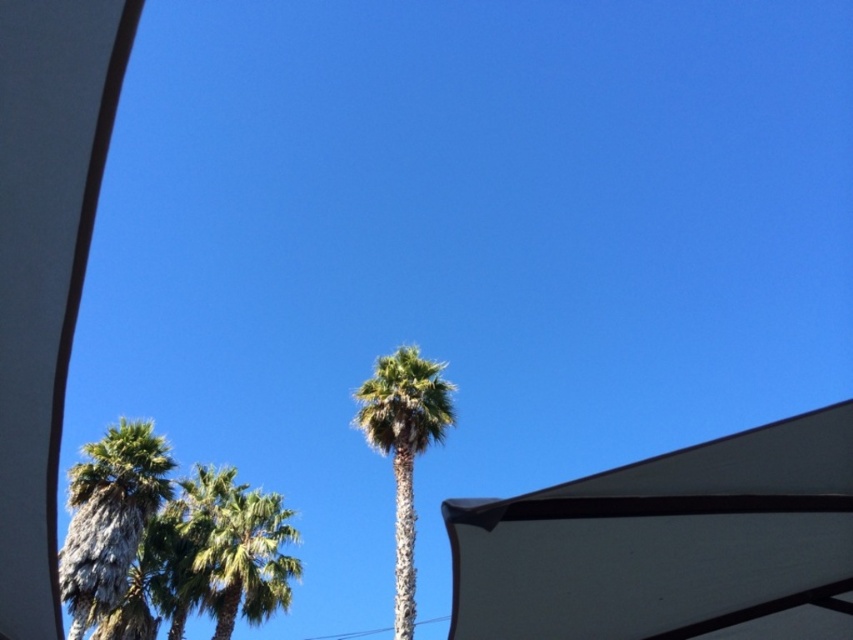
You are standing in a garden and want to walk from the white matte canopy at left to the green textured palm tree at center. Which direction should you face to move towards the tree?

You should face towards the center of the image because the green textured palm tree at center is further away from you than the white matte canopy at left, so moving towards the center will lead you toward the tree.